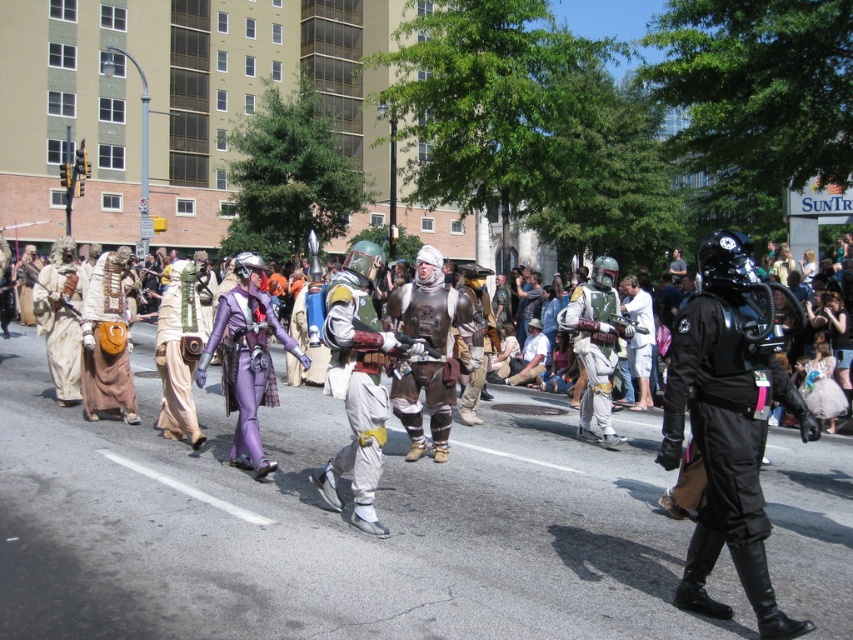
You are a photographer at the parade trying to capture both the black matte helmet at right and the white matte helmet at center in a single frame. Which helmet should you focus on to ensure both are in the frame without zooming in too much?

You should focus on the black matte helmet at right because it is bigger than the white matte helmet at center, so keeping it centered will allow the smaller white matte helmet at center to remain within the frame without excessive zooming.

You are a photographer trying to capture the parade scene. You notice two points in the image, one at coordinates point (718, 289) and another at point (236, 355). Which point is more in focus if you focus on the foreground elements?

Point (718, 289) is closer to the camera than point (236, 355), so if you focus on the foreground elements, point (718, 289) will be more in focus.

You are a photographer at the parade and want to capture both the purple matte suit at center and the tan fabric bag at left in a single shot. Which object should you frame first to ensure both are in the shot?

The tan fabric bag at left should be framed first since the purple matte suit at center is positioned to its right, so starting with the tan fabric bag at left ensures both are included in the shot.